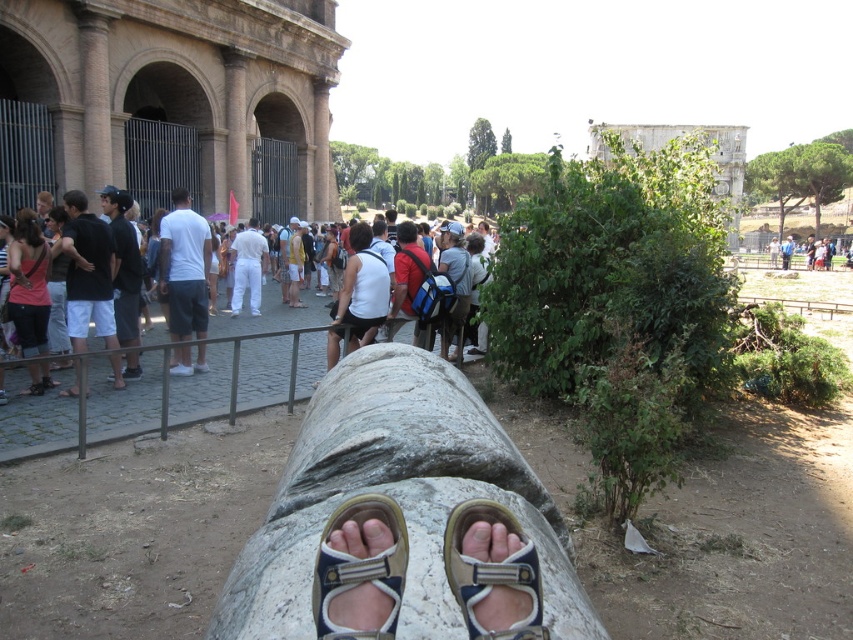
In the scene shown: Which is above, tan fabric sandal at center or matte pink tank top at left?

matte pink tank top at left is above.

Between tan fabric sandal at center and matte pink tank top at left, which one has more height?

tan fabric sandal at center

Where is `tan fabric sandal at center`? Image resolution: width=853 pixels, height=640 pixels. tan fabric sandal at center is located at coordinates (360, 566).

The height and width of the screenshot is (640, 853). Describe the element at coordinates (395, 499) in the screenshot. I see `white rough log at center` at that location.

Which is more to the right, white rough log at center or tan fabric sandal at center?

From the viewer's perspective, white rough log at center appears more on the right side.

Does point (397, 378) come farther from viewer compared to point (363, 579)?

Yes, it is behind point (363, 579).

The image size is (853, 640). Identify the location of white rough log at center. coord(395,499).

Who is shorter, tan fabric sandal at center or blue fabric sandal at center?

With less height is tan fabric sandal at center.

Can you confirm if tan fabric sandal at center is taller than blue fabric sandal at center?

In fact, tan fabric sandal at center may be shorter than blue fabric sandal at center.

Describe the element at coordinates (360, 566) in the screenshot. I see `tan fabric sandal at center` at that location.

This screenshot has width=853, height=640. Find the location of `tan fabric sandal at center`. tan fabric sandal at center is located at coordinates (360, 566).